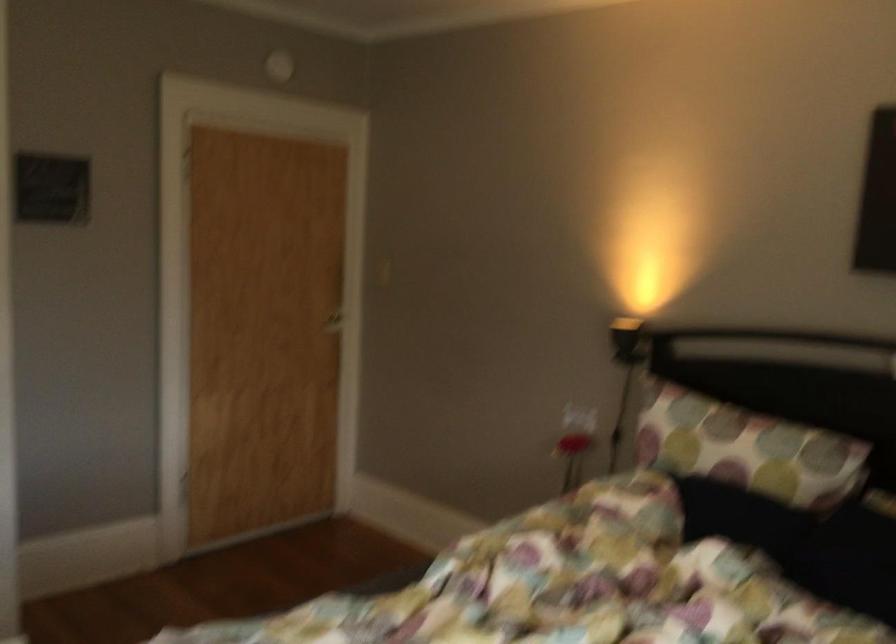
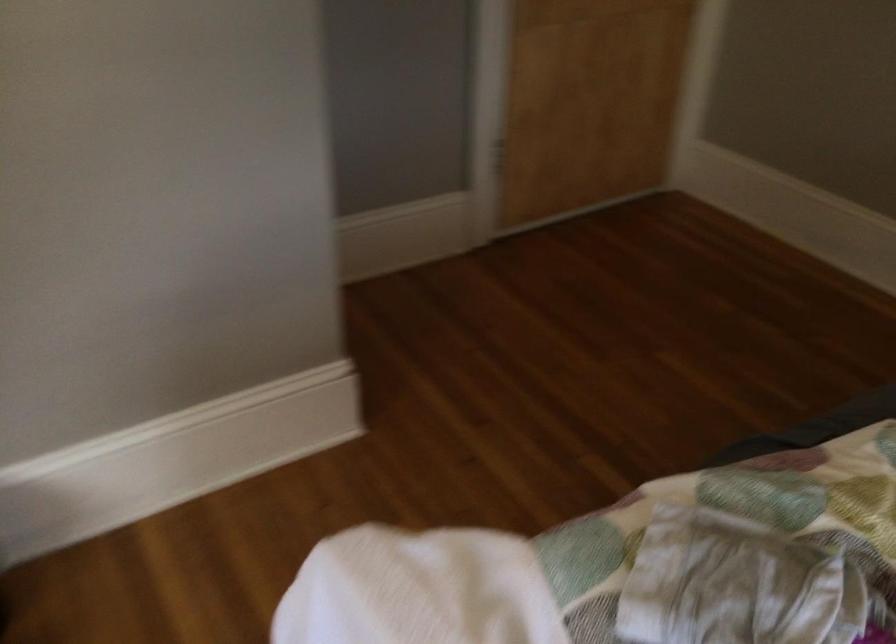
Question: The images are taken continuously from a first-person perspective. In which direction is your viewpoint rotating?

Choices:
 (A) Left
 (B) Right
 (C) Up
 (D) Down

Answer: (D)